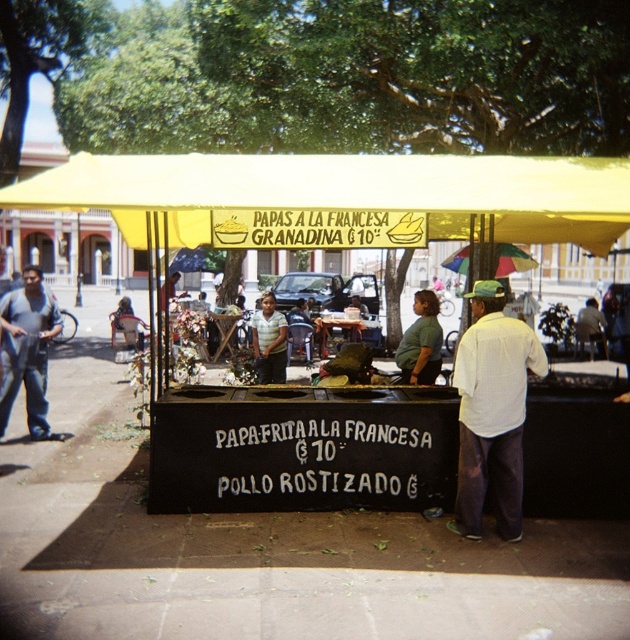
You are a customer approaching the street food stall. You see the yellow fabric canopy at center and the striped shirt at center. Which object is positioned higher relative to the other?

The yellow fabric canopy at center is located above the striped shirt at center, so it is positioned higher.

You are a customer at the street food stall. You want to order food from the vendor. Which object, the gray cotton pants at left or the striped shirt at center, is the vendor wearing?

The vendor is wearing the striped shirt at center because the gray cotton pants at left is much taller than the striped shirt at center, implying that the striped shirt is part of the vendor or customer closer to the center.

You are a customer approaching the street food stall. You see the white textured shirt at center and the striped shirt at center. Which person should you address first for ordering food?

The white textured shirt at center is in front of striped shirt at center, so you should address the person wearing the white textured shirt at center first as they are likely the vendor.